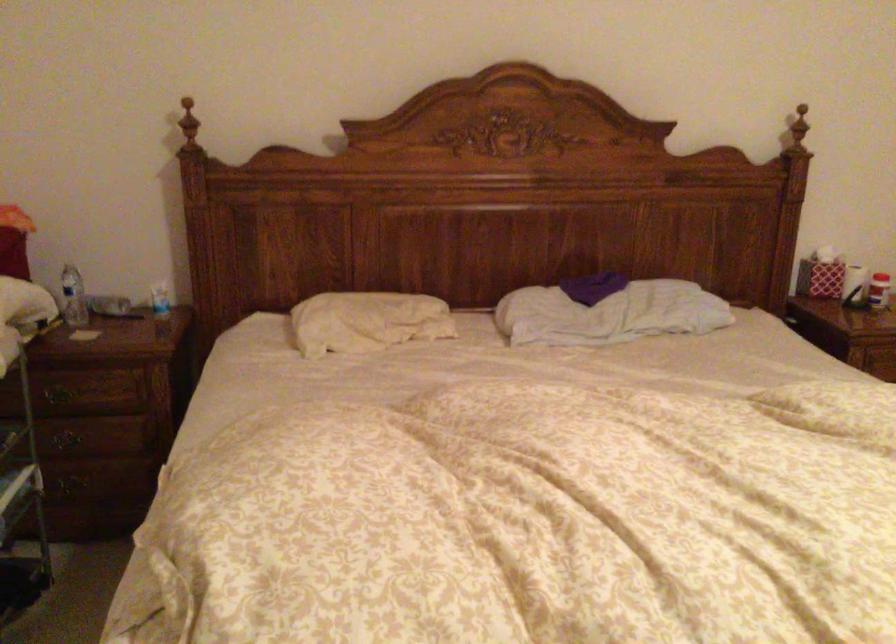
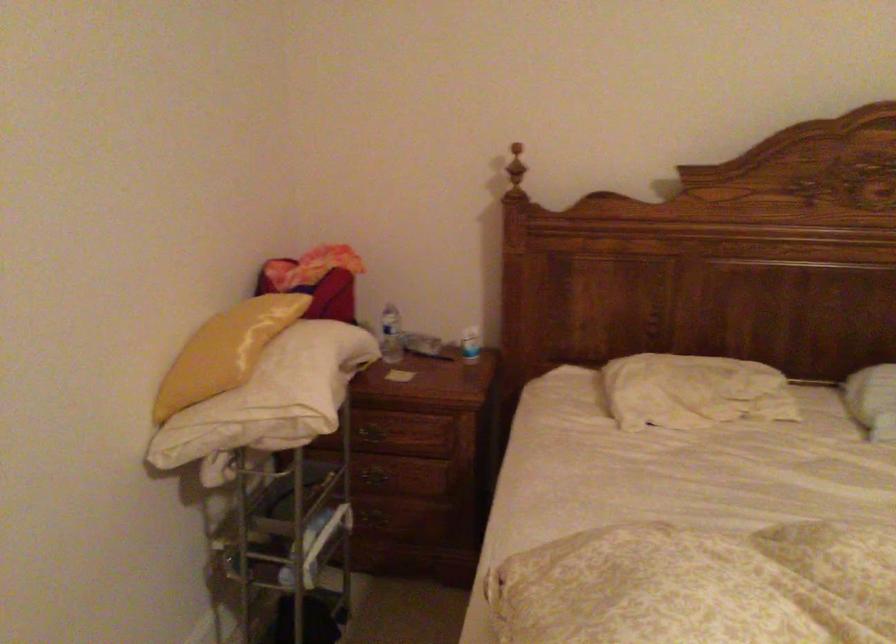
Locate, in the second image, the point that corresponds to point 73,480 in the first image.

(381, 516)